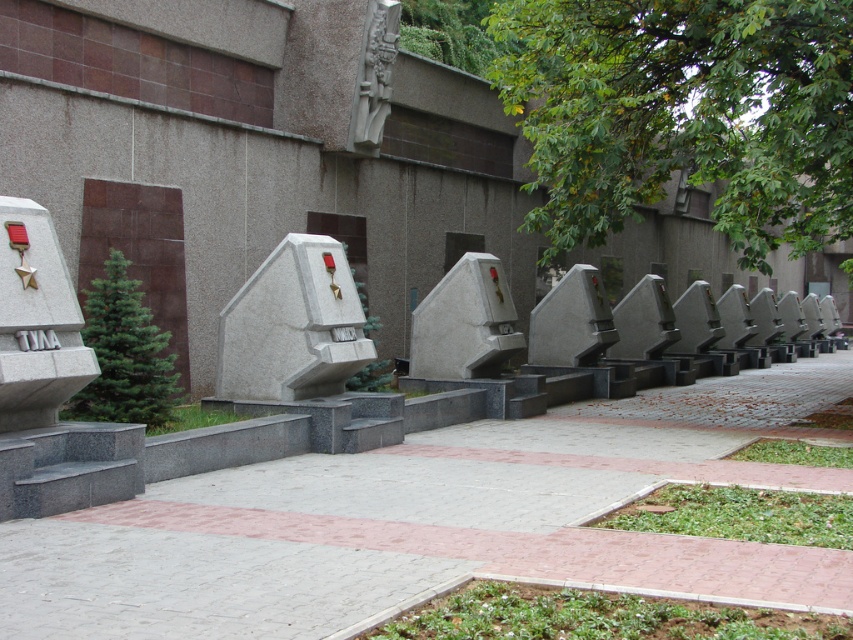
You are standing in front of the row of memorials and notice two points marked on the wall. The first point is at coordinates point (x=315, y=365) and the second is at point (x=393, y=51). Which point is nearer to you?

Point (x=315, y=365) is closer to the viewer than point (x=393, y=51).

You are standing in front of the row of memorials and notice the white marble sculpture at center and the gray stone carving at upper center. Which object is positioned to the right of the other?

The white marble sculpture at center is to the right of the gray stone carving at upper center.

Looking at this image, you are standing in front of the memorials and want to place a new plaque between the white stone sculpture at center and the white marble sculpture at center. How much space do you have between them to place the plaque?

The space between the white stone sculpture at center and the white marble sculpture at center is 3.50 meters, so there is sufficient space to place the plaque between them.